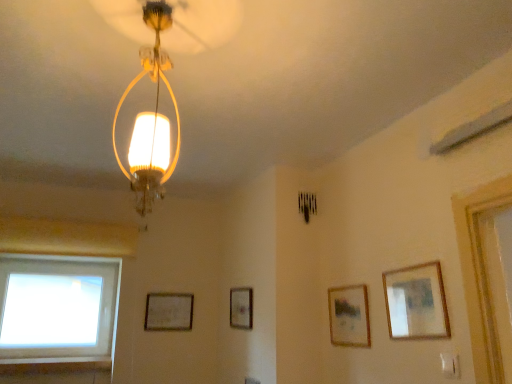
Question: In terms of width, does matte silver picture frame at lower left, the 4th picture frame when ordered from front to back, look wider or thinner when compared to transparent glass window at lower left?

Choices:
 (A) thin
 (B) wide

Answer: (A)

Question: In the image, is matte silver picture frame at lower left, the first picture frame viewed from the back, positioned in front of or behind transparent glass window at lower left?

Choices:
 (A) front
 (B) behind

Answer: (B)

Question: Estimate the real-world distances between objects in this image. Which object is farther from the wooden framed picture at center, which is the third picture frame from right to left?

Choices:
 (A) wooden picture frame at upper right, marked as the 1th picture frame in a right-to-left arrangement
 (B) transparent glass window at lower left
 (C) wooden framed picture at center right, which is counted as the 3th picture frame, starting from the back
 (D) matte silver picture frame at lower left, the 4th picture frame when ordered from front to back
 (E) matte glass lampshade at upper center

Answer: (E)

Question: Estimate the real-world distances between objects in this image. Which object is closer to the wooden framed picture at center, acting as the second picture frame starting from the back?

Choices:
 (A) matte glass lampshade at upper center
 (B) wooden picture frame at upper right, acting as the 1th picture frame starting from the front
 (C) wooden framed picture at center right, arranged as the 3th picture frame when viewed from the left
 (D) matte silver picture frame at lower left, the first picture frame viewed from the back
 (E) transparent glass window at lower left

Answer: (D)